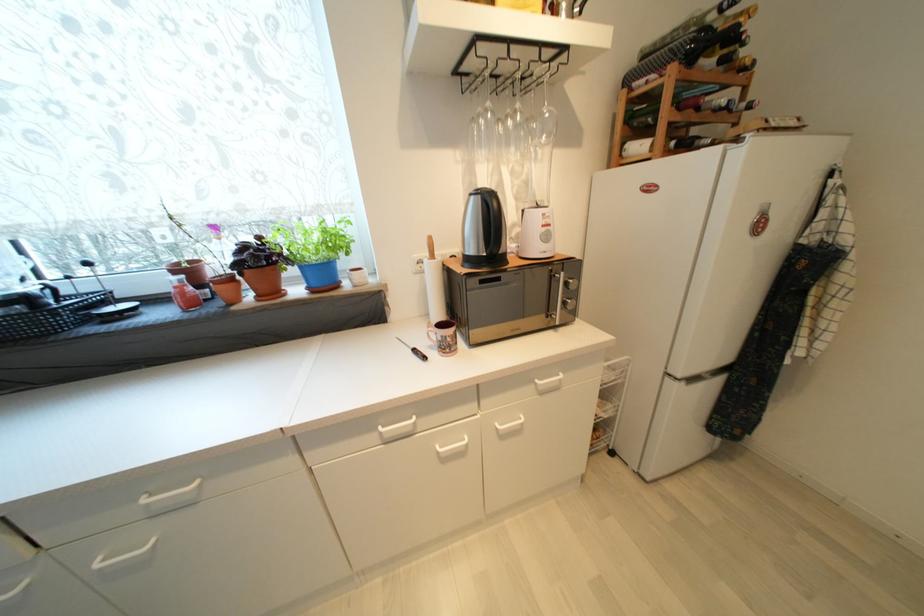
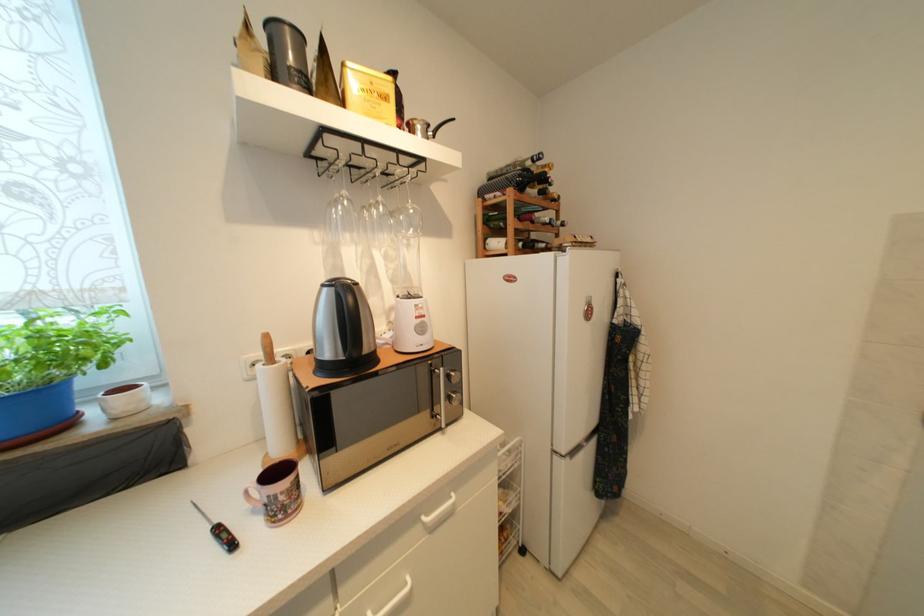
Locate, in the second image, the point that corresponds to the point at 707,63 in the first image.

(533, 192)